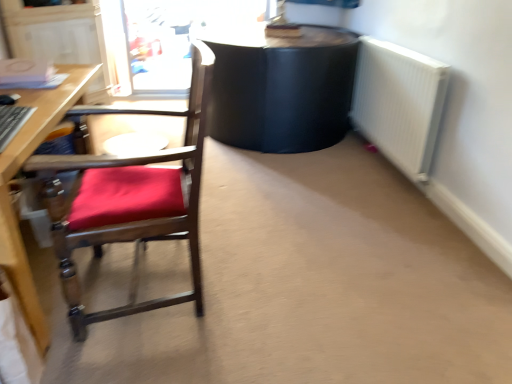
This screenshot has width=512, height=384. I want to click on wooden chair with red cushion at left, so click(129, 200).

Find the location of a particular element. The width and height of the screenshot is (512, 384). white metallic radiator at right is located at coordinates (399, 103).

Is white metallic radiator at right positioned behind wooden chair with red cushion at left?

Yes, white metallic radiator at right is further from the camera.

From a real-world perspective, does white metallic radiator at right sit lower than wooden chair with red cushion at left?

Yes, from a real-world perspective, white metallic radiator at right is under wooden chair with red cushion at left.

This screenshot has width=512, height=384. Find the location of `radiator directly beneath the wooden chair with red cushion at left (from a real-world perspective)`. radiator directly beneath the wooden chair with red cushion at left (from a real-world perspective) is located at coordinates (399, 103).

Considering the positions of objects white metallic radiator at right and transparent plastic screen door at upper left in the image provided, who is more to the left, white metallic radiator at right or transparent plastic screen door at upper left?

transparent plastic screen door at upper left is more to the left.

Is white metallic radiator at right not inside transparent plastic screen door at upper left?

That's correct, white metallic radiator at right is outside of transparent plastic screen door at upper left.

Could you tell me if white metallic radiator at right is turned towards transparent plastic screen door at upper left?

No, white metallic radiator at right does not turn towards transparent plastic screen door at upper left.

Considering the relative positions of wooden chair with red cushion at left and white metallic radiator at right in the image provided, is wooden chair with red cushion at left to the right of white metallic radiator at right from the viewer's perspective?

No.

Is wooden chair with red cushion at left next to white metallic radiator at right and touching it?

No, wooden chair with red cushion at left is not with white metallic radiator at right.

Is wooden chair with red cushion at left aimed at white metallic radiator at right?

No, wooden chair with red cushion at left is not aimed at white metallic radiator at right.

Considering the sizes of objects wooden chair with red cushion at left and white metallic radiator at right in the image provided, who is bigger, wooden chair with red cushion at left or white metallic radiator at right?

wooden chair with red cushion at left is bigger.

From a real-world perspective, between wooden chair with red cushion at left and transparent plastic screen door at upper left, who is vertically lower?

wooden chair with red cushion at left is physically lower.

From the image's perspective, is wooden chair with red cushion at left above or below transparent plastic screen door at upper left?

Based on their image positions, wooden chair with red cushion at left is located beneath transparent plastic screen door at upper left.

Is wooden chair with red cushion at left taller or shorter than transparent plastic screen door at upper left?

In the image, wooden chair with red cushion at left appears to be taller than transparent plastic screen door at upper left.

Is wooden chair with red cushion at left inside or outside of transparent plastic screen door at upper left?

wooden chair with red cushion at left is spatially situated outside transparent plastic screen door at upper left.

Is transparent plastic screen door at upper left with wooden chair with red cushion at left?

transparent plastic screen door at upper left and wooden chair with red cushion at left are clearly separated.

From the image's perspective, would you say transparent plastic screen door at upper left is shown under wooden chair with red cushion at left?

No.

Consider the image. Which of these two, transparent plastic screen door at upper left or wooden chair with red cushion at left, stands shorter?

With less height is transparent plastic screen door at upper left.

Based on their sizes in the image, would you say transparent plastic screen door at upper left is bigger or smaller than wooden chair with red cushion at left?

Clearly, transparent plastic screen door at upper left is smaller in size than wooden chair with red cushion at left.

What's the angular difference between transparent plastic screen door at upper left and white metallic radiator at right's facing directions?

90.6 degrees.

Is transparent plastic screen door at upper left in front of white metallic radiator at right?

No, it is behind white metallic radiator at right.

Which is in front, point (199, 13) or point (395, 104)?

The point (395, 104) is in front.

From a real-world perspective, who is located lower, transparent plastic screen door at upper left or white metallic radiator at right?

white metallic radiator at right.

I want to click on radiator that appears on the right of wooden chair with red cushion at left, so click(x=399, y=103).

At what (x,y) coordinates should I click in order to perform the action: click on radiator lying below the transparent plastic screen door at upper left (from the image's perspective). Please return your answer as a coordinate pair (x, y). The width and height of the screenshot is (512, 384). Looking at the image, I should click on (399, 103).

Estimate the real-world distances between objects in this image. Which object is further from transparent plastic screen door at upper left, wooden chair with red cushion at left or white metallic radiator at right?

Based on the image, wooden chair with red cushion at left appears to be further to transparent plastic screen door at upper left.

Which object lies nearer to the anchor point wooden chair with red cushion at left, transparent plastic screen door at upper left or white metallic radiator at right?

white metallic radiator at right is closer to wooden chair with red cushion at left.

Looking at this image, from the image, which object appears to be nearer to transparent plastic screen door at upper left, white metallic radiator at right or wooden chair with red cushion at left?

The object closer to transparent plastic screen door at upper left is white metallic radiator at right.

Looking at the image, which one is located closer to white metallic radiator at right, wooden chair with red cushion at left or transparent plastic screen door at upper left?

Based on the image, wooden chair with red cushion at left appears to be nearer to white metallic radiator at right.

Estimate the real-world distances between objects in this image. Which object is further from wooden chair with red cushion at left, white metallic radiator at right or transparent plastic screen door at upper left?

The object further to wooden chair with red cushion at left is transparent plastic screen door at upper left.

Looking at this image, when comparing their distances from white metallic radiator at right, does transparent plastic screen door at upper left or wooden chair with red cushion at left seem closer?

wooden chair with red cushion at left.

At what (x,y) coordinates should I click in order to perform the action: click on radiator between wooden chair with red cushion at left and transparent plastic screen door at upper left along the z-axis. Please return your answer as a coordinate pair (x, y). The height and width of the screenshot is (384, 512). Looking at the image, I should click on (399, 103).